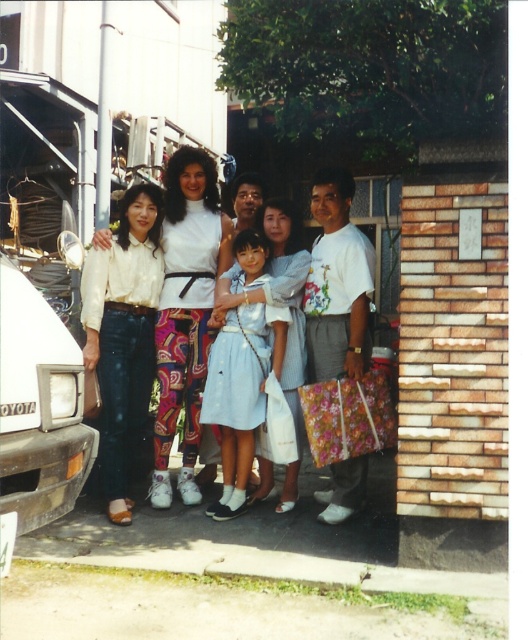
Between black matte van at left and light blue fabric dress at center, which one appears on the left side from the viewer's perspective?

black matte van at left is more to the left.

Between black matte van at left and light blue fabric dress at center, which one has more height?

Standing taller between the two is light blue fabric dress at center.

What do you see at coordinates (39, 406) in the screenshot?
I see `black matte van at left` at bounding box center [39, 406].

This screenshot has height=640, width=528. Identify the location of black matte van at left. (39, 406).

Does white matte blouse at center have a greater width compared to light blue fabric dress at center?

Incorrect, white matte blouse at center's width does not surpass light blue fabric dress at center's.

Is white matte blouse at center thinner than light blue fabric dress at center?

Yes, white matte blouse at center is thinner than light blue fabric dress at center.

Measure the distance between white matte blouse at center and camera.

white matte blouse at center is 5.33 meters away from camera.

Where is `white matte blouse at center`? This screenshot has height=640, width=528. white matte blouse at center is located at coordinates (185, 310).

Is point (32, 353) behind point (186, 273)?

No, (32, 353) is in front of (186, 273).

Can you confirm if black matte van at left is wider than white matte blouse at center?

Yes.

Is point (62, 449) positioned behind point (186, 472)?

No, it is not.

Locate an element on the screen. black matte van at left is located at coordinates point(39,406).